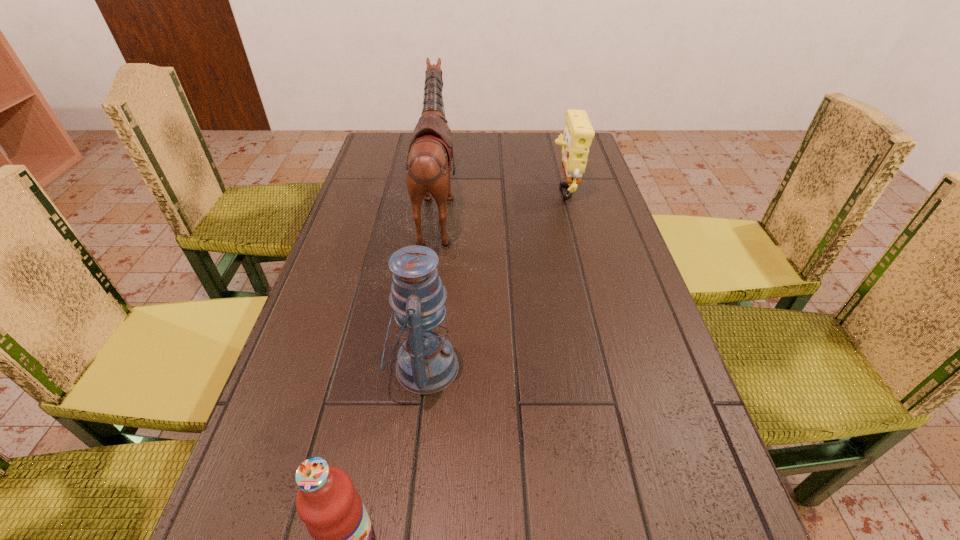
The image size is (960, 540). In order to click on saddle in this screenshot , I will do `click(428, 165)`.

I want to click on lantern, so click(x=426, y=363).

At what (x,y) coordinates should I click in order to perform the action: click on the third farthest object. Please return your answer as a coordinate pair (x, y). The height and width of the screenshot is (540, 960). Looking at the image, I should click on (426, 363).

Identify the location of the rightmost object. This screenshot has width=960, height=540. (578, 133).

You are a GUI agent. You are given a task and a screenshot of the screen. Output one action in this format:
    pyautogui.click(x=<x>, y=<y>)
    Task: Click on the vacant space located 0.310m on the back of the tallest object
    The image size is (960, 540).
    Given the screenshot: What is the action you would take?
    pyautogui.click(x=568, y=209)

Locate an element on the screen. The height and width of the screenshot is (540, 960). free space located on the front-facing side of the third farthest object is located at coordinates (651, 367).

Locate an element on the screen. free location located 0.100m on the face of the rightmost object is located at coordinates (515, 188).

What are the coordinates of `free space located on the face of the rightmost object` in the screenshot? It's located at (521, 188).

Find the location of a particular element. blank area located 0.050m on the face of the rightmost object is located at coordinates (531, 188).

At what (x,y) coordinates should I click in order to perform the action: click on object at the right edge. Please return your answer as a coordinate pair (x, y). The height and width of the screenshot is (540, 960). Looking at the image, I should click on (578, 133).